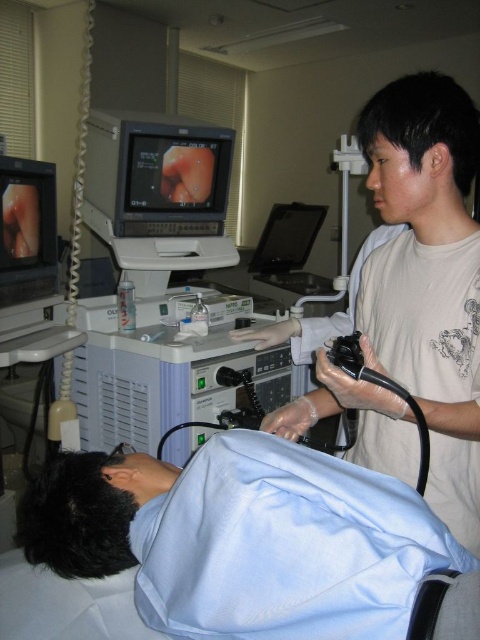
Is matte black monitor at left positioned behind black glossy monitor at center?

No, matte black monitor at left is closer to the viewer.

Can you confirm if matte black monitor at left is positioned to the right of black glossy monitor at center?

No, matte black monitor at left is not to the right of black glossy monitor at center.

You are a GUI agent. You are given a task and a screenshot of the screen. Output one action in this format:
    pyautogui.click(x=<x>, y=<y>)
    Task: Click on the matte black monitor at left
    Image resolution: width=480 pixels, height=640 pixels.
    Given the screenshot: What is the action you would take?
    pyautogui.click(x=26, y=230)

Based on the photo, between white matte shirt at upper right and matte black monitor at left, which one is positioned higher?

matte black monitor at left

Can you confirm if white matte shirt at upper right is taller than matte black monitor at left?

Indeed, white matte shirt at upper right has a greater height compared to matte black monitor at left.

This screenshot has width=480, height=640. Identify the location of white matte shirt at upper right. (428, 276).

Image resolution: width=480 pixels, height=640 pixels. I want to click on white matte shirt at upper right, so click(x=428, y=276).

Where is `black glossy monitor at upper center`? black glossy monitor at upper center is located at coordinates (157, 173).

Is point (178, 221) behind point (28, 275)?

That is True.

Find the location of `black glossy monitor at upper center`. black glossy monitor at upper center is located at coordinates (157, 173).